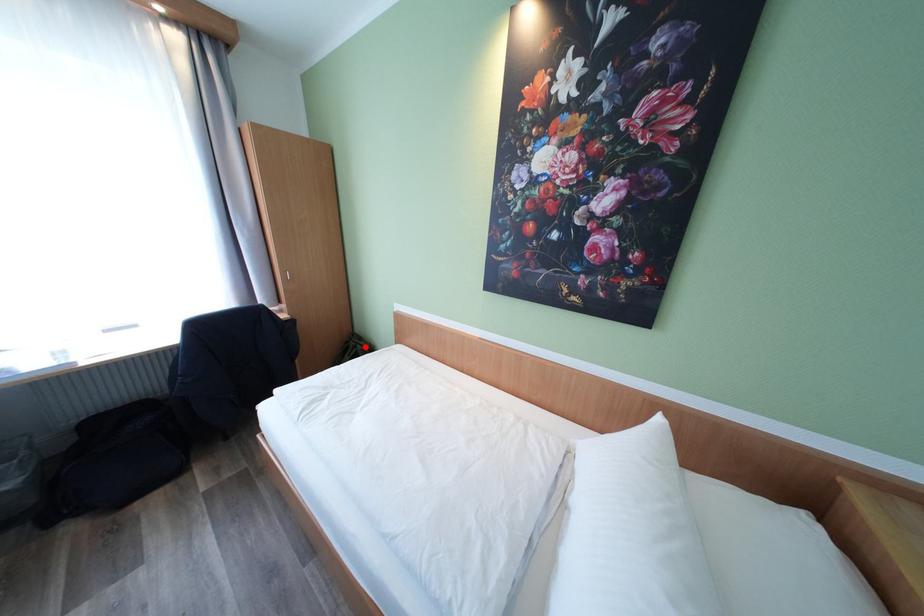
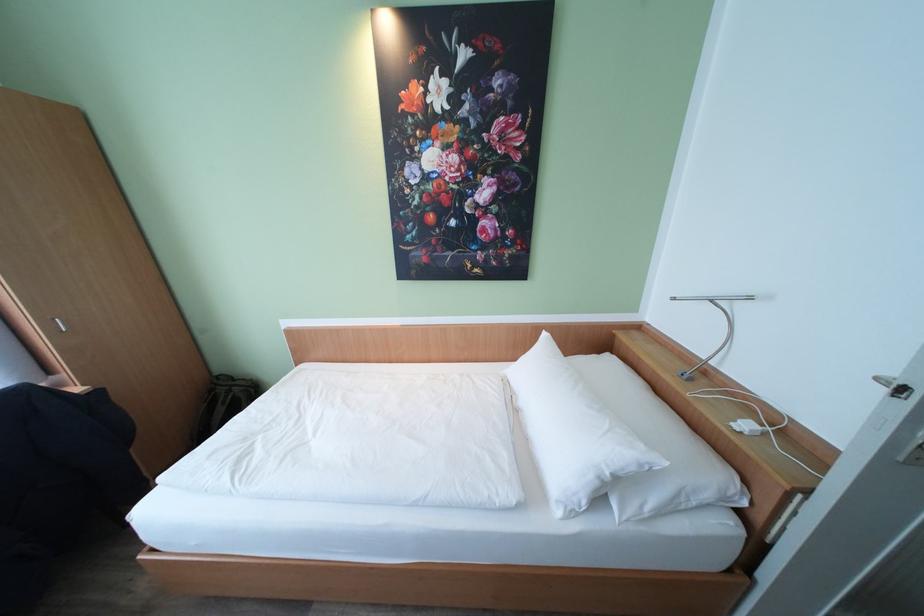
Where in the second image is the point corresponding to the highlighted location from the first image?

(241, 389)